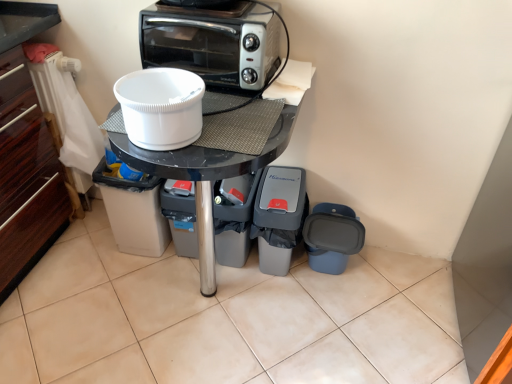
What are the coordinates of `vacant space in front of blue plastic trash can at lower right, the 1th appliance positioned from the right` in the screenshot? It's located at (335, 314).